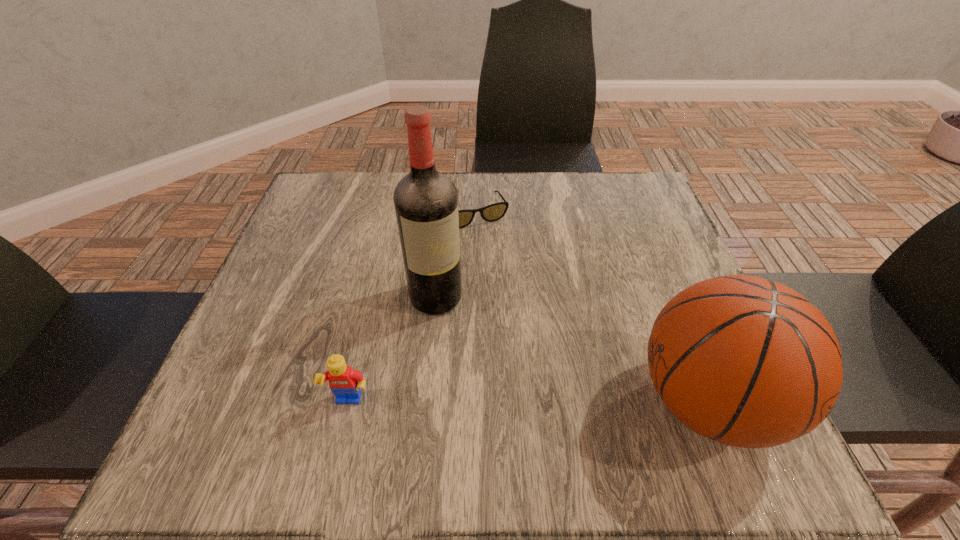
At what (x,y) coordinates should I click in order to perform the action: click on vacant space that is in between the shortest object and the basketball. Please return your answer as a coordinate pair (x, y). This screenshot has height=540, width=960. Looking at the image, I should click on (589, 308).

You are a GUI agent. You are given a task and a screenshot of the screen. Output one action in this format:
    pyautogui.click(x=<x>, y=<y>)
    Task: Click on the free spot between the leftmost object and the shortest object
    This screenshot has height=540, width=960.
    Given the screenshot: What is the action you would take?
    pyautogui.click(x=411, y=309)

Image resolution: width=960 pixels, height=540 pixels. I want to click on free space between the Lego and the sunglasses, so click(x=411, y=309).

Where is `free space between the basketball and the farthest object`? This screenshot has height=540, width=960. free space between the basketball and the farthest object is located at coordinates (589, 308).

At what (x,y) coordinates should I click in order to perform the action: click on vacant region between the leftmost object and the third shortest object. Please return your answer as a coordinate pair (x, y). The image size is (960, 540). Looking at the image, I should click on (528, 403).

Find the location of a particular element. free spot between the liquor and the third shortest object is located at coordinates (571, 349).

Select which object appears as the second closest to the second farthest object. Please provide its 2D coordinates. Your answer should be formatted as a tuple, i.e. [(x, y)], where the tuple contains the x and y coordinates of a point satisfying the conditions above.

[(344, 382)]

This screenshot has width=960, height=540. In order to click on object that is the second closest to the rightmost object in this screenshot , I will do `click(493, 212)`.

This screenshot has height=540, width=960. Identify the location of vacant region that satisfies the following two spatial constraints: 1. on the back side of the second farthest object; 2. on the left side of the farthest object. point(444,214).

Where is `vacant region that satisfies the following two spatial constraints: 1. on the back side of the sunglasses; 2. on the left side of the liquor`? vacant region that satisfies the following two spatial constraints: 1. on the back side of the sunglasses; 2. on the left side of the liquor is located at coordinates (444, 214).